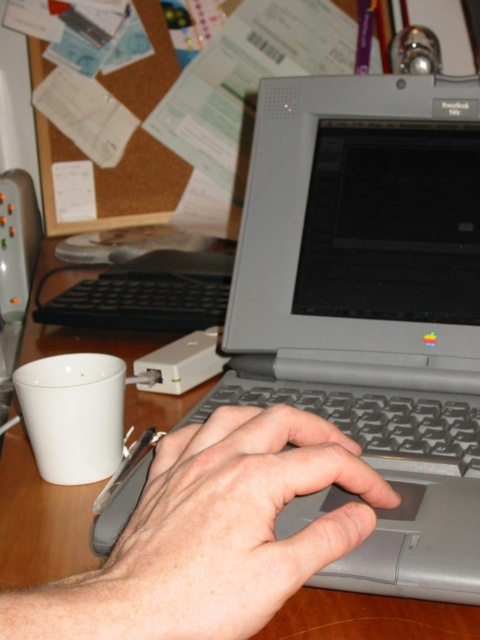
Question: Can you confirm if gray plastic keyboard at center is bigger than wooden table at center?

Choices:
 (A) yes
 (B) no

Answer: (B)

Question: Considering the real-world distances, which object is closest to the wooden table at center?

Choices:
 (A) gray matte hand at center
 (B) gray plastic keyboard at center
 (C) black plastic keyboard at center

Answer: (C)

Question: Which of the following is the closest to the observer?

Choices:
 (A) (165, 316)
 (B) (9, 497)

Answer: (B)

Question: Estimate the real-world distances between objects in this image. Which object is farther from the gray plastic keyboard at center?

Choices:
 (A) gray matte hand at center
 (B) black plastic keyboard at center
 (C) wooden table at center

Answer: (B)

Question: Can you confirm if gray matte hand at center is positioned above gray plastic keyboard at center?

Choices:
 (A) yes
 (B) no

Answer: (B)

Question: Is gray matte hand at center behind black plastic keyboard at center?

Choices:
 (A) yes
 (B) no

Answer: (B)